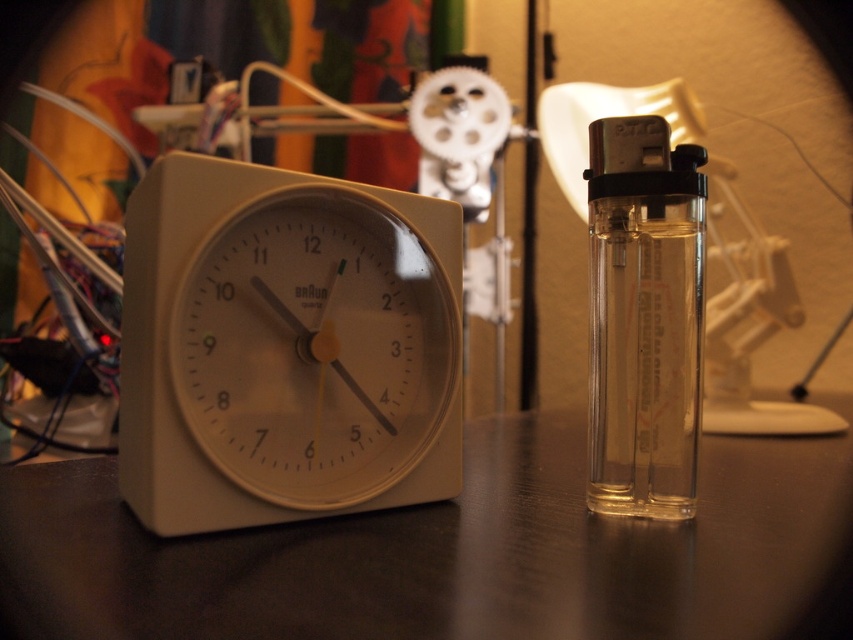
Who is positioned more to the right, black matte table at center or transparent plastic lighter at right?

From the viewer's perspective, transparent plastic lighter at right appears more on the right side.

Locate an element on the screen. black matte table at center is located at coordinates (451, 554).

Can you confirm if black matte table at center is smaller than white plastic clock at left?

Incorrect, black matte table at center is not smaller in size than white plastic clock at left.

Who is taller, black matte table at center or white plastic clock at left?

With more height is white plastic clock at left.

Does point (44, 563) lie in front of point (228, 333)?

Yes.

Where is `black matte table at center`? black matte table at center is located at coordinates (451, 554).

Is white plastic clock at left positioned behind transparent plastic lighter at right?

No, it is in front of transparent plastic lighter at right.

Identify the location of white plastic clock at left. Image resolution: width=853 pixels, height=640 pixels. (283, 348).

This screenshot has width=853, height=640. What do you see at coordinates (283, 348) in the screenshot?
I see `white plastic clock at left` at bounding box center [283, 348].

Find the location of a particular element. The image size is (853, 640). white plastic clock at left is located at coordinates click(283, 348).